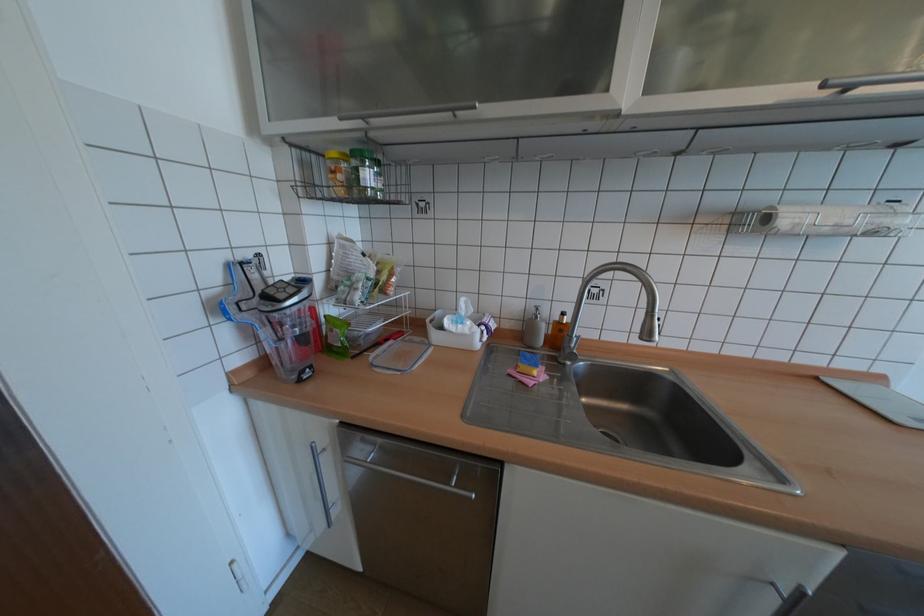
Describe the element at coordinates (563, 317) in the screenshot. The width and height of the screenshot is (924, 616). I see `the orange bottle pump` at that location.